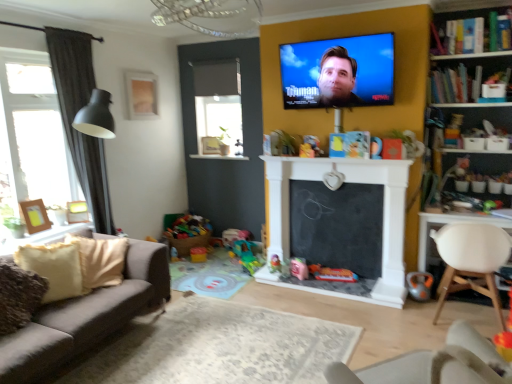
Identify the location of vacant area that is in front of plastic green toy at center, placed as the third toy when sorted from bottom to top. (243, 278).